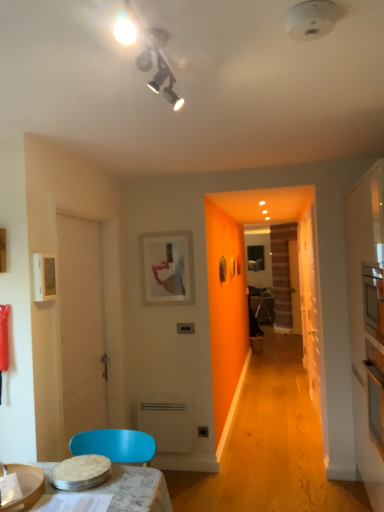
Question: Based on their sizes in the image, would you say white plastic radiator at lower center is bigger or smaller than matte white picture frame at upper left, the 1th picture frame when ordered from left to right?

Choices:
 (A) big
 (B) small

Answer: (A)

Question: Which is correct: white plastic radiator at lower center is inside matte white picture frame at upper left, the 1th picture frame when ordered from left to right, or outside of it?

Choices:
 (A) inside
 (B) outside

Answer: (B)

Question: Based on their relative distances, which object is nearer to the white plastic radiator at lower center?

Choices:
 (A) matte white picture frame at center, which appears as the second picture frame when viewed from the left
 (B) white matte door at left
 (C) white glossy microwave at right
 (D) transparent glass door at right
 (E) matte white picture frame at upper left, the 1th picture frame when ordered from left to right

Answer: (B)

Question: Which object is the farthest from the matte white picture frame at upper left, which is counted as the second picture frame, starting from the back?

Choices:
 (A) matte white picture frame at center, the second picture frame when ordered from front to back
 (B) white matte door at left
 (C) white glossy microwave at right
 (D) transparent glass door at right
 (E) white plastic radiator at lower center

Answer: (D)